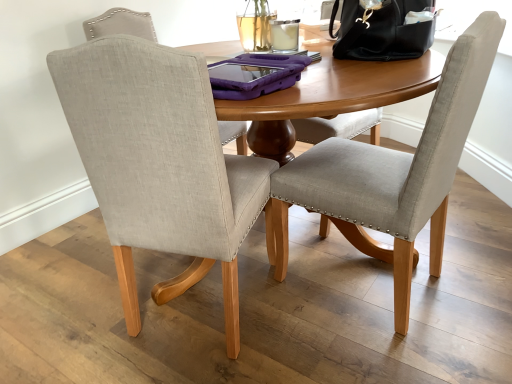
Question: From a real-world perspective, is beige fabric chair at center, the second chair in the right-to-left sequence, under light gray fabric chair at center, which ranks as the 1th chair in right-to-left order?

Choices:
 (A) yes
 (B) no

Answer: (B)

Question: Is beige fabric chair at center, the second chair in the right-to-left sequence, aimed at light gray fabric chair at center, arranged as the 2th chair when viewed from the left?

Choices:
 (A) no
 (B) yes

Answer: (A)

Question: Is beige fabric chair at center, which appears as the 1th chair when viewed from the left, bigger than light gray fabric chair at center, which ranks as the 1th chair in right-to-left order?

Choices:
 (A) yes
 (B) no

Answer: (A)

Question: Is beige fabric chair at center, which appears as the 1th chair when viewed from the left, placed right next to light gray fabric chair at center, arranged as the 2th chair when viewed from the left?

Choices:
 (A) no
 (B) yes

Answer: (A)

Question: Does beige fabric chair at center, the second chair in the right-to-left sequence, have a greater height compared to light gray fabric chair at center, arranged as the 2th chair when viewed from the left?

Choices:
 (A) no
 (B) yes

Answer: (B)

Question: Which is correct: light gray fabric chair at center, arranged as the 2th chair when viewed from the left, is inside black leather handbag at upper right, or outside of it?

Choices:
 (A) inside
 (B) outside

Answer: (B)

Question: Does point (388, 253) appear closer or farther from the camera than point (406, 9)?

Choices:
 (A) closer
 (B) farther

Answer: (B)

Question: From a real-world perspective, relative to black leather handbag at upper right, is light gray fabric chair at center, arranged as the 2th chair when viewed from the left, vertically above or below?

Choices:
 (A) above
 (B) below

Answer: (B)

Question: Would you say light gray fabric chair at center, arranged as the 2th chair when viewed from the left, is to the left or to the right of black leather handbag at upper right in the picture?

Choices:
 (A) left
 (B) right

Answer: (A)

Question: Which is correct: black leather handbag at upper right is inside light gray fabric chair at center, arranged as the 2th chair when viewed from the left, or outside of it?

Choices:
 (A) inside
 (B) outside

Answer: (B)

Question: Looking at their shapes, would you say black leather handbag at upper right is wider or thinner than light gray fabric chair at center, which ranks as the 1th chair in right-to-left order?

Choices:
 (A) thin
 (B) wide

Answer: (A)

Question: Is point (344, 13) closer or farther from the camera than point (473, 109)?

Choices:
 (A) closer
 (B) farther

Answer: (B)

Question: From the image's perspective, is black leather handbag at upper right positioned above or below light gray fabric chair at center, arranged as the 2th chair when viewed from the left?

Choices:
 (A) above
 (B) below

Answer: (A)

Question: Looking at their shapes, would you say beige fabric chair at center, the second chair in the right-to-left sequence, is wider or thinner than light gray fabric chair at center, arranged as the 2th chair when viewed from the left?

Choices:
 (A) wide
 (B) thin

Answer: (A)

Question: Is beige fabric chair at center, which appears as the 1th chair when viewed from the left, in front of or behind light gray fabric chair at center, which ranks as the 1th chair in right-to-left order, in the image?

Choices:
 (A) behind
 (B) front

Answer: (B)